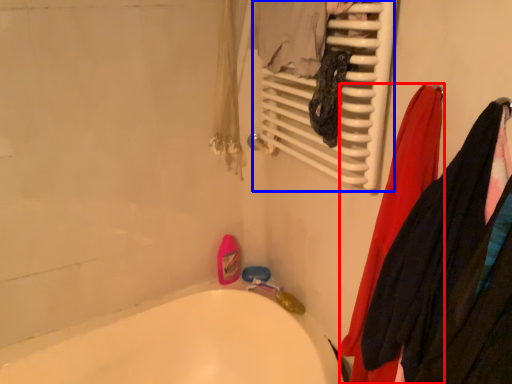
Question: Which of the following is the farthest to the observer, clothing (highlighted by a red box) or radiator (highlighted by a blue box)?

Choices:
 (A) clothing
 (B) radiator

Answer: (B)